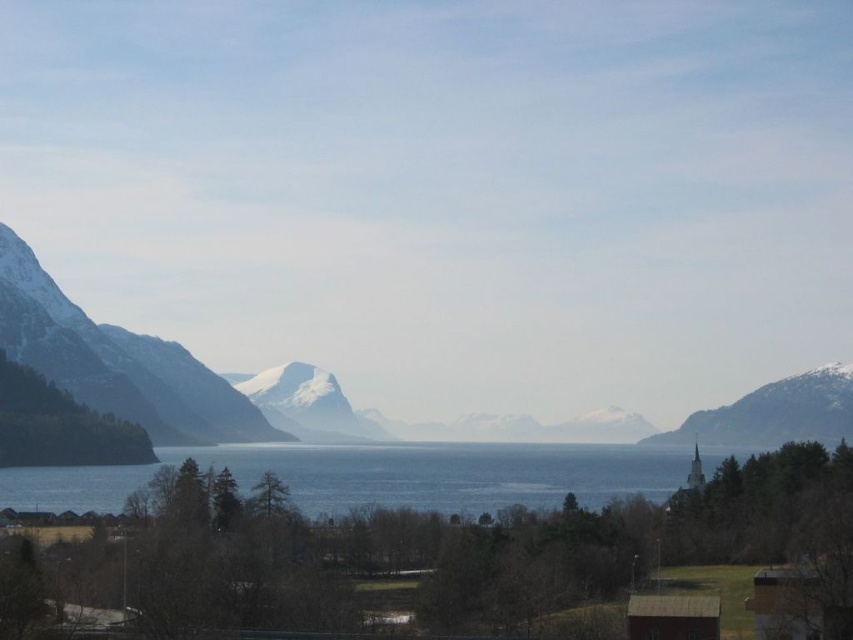
Who is more forward, (62, 477) or (753, 400)?

Point (62, 477) is more forward.

Is point (225, 451) positioned in front of point (807, 417)?

Yes, point (225, 451) is closer to viewer.

Locate an element on the screen. The height and width of the screenshot is (640, 853). blue water at center is located at coordinates (378, 476).

Measure the distance from blue water at center to snowy rock mountain at left.

blue water at center is 45.52 meters away from snowy rock mountain at left.

Who is more forward, (x=398, y=464) or (x=202, y=419)?

Point (x=398, y=464) is more forward.

Does point (105, 481) come behind point (122, 344)?

No, it is in front of (122, 344).

Locate an element on the screen. Image resolution: width=853 pixels, height=640 pixels. blue water at center is located at coordinates (378, 476).

Can you confirm if snowy rock mountain at left is wider than snowy rock mountain at right?

Correct, the width of snowy rock mountain at left exceeds that of snowy rock mountain at right.

Does snowy rock mountain at left appear on the right side of snowy rock mountain at right?

Incorrect, snowy rock mountain at left is not on the right side of snowy rock mountain at right.

What do you see at coordinates (120, 362) in the screenshot?
I see `snowy rock mountain at left` at bounding box center [120, 362].

Find the location of a particular element. The width and height of the screenshot is (853, 640). snowy rock mountain at left is located at coordinates [120, 362].